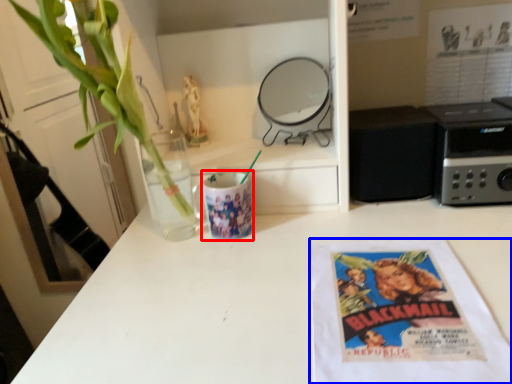
Question: Among these objects, which one is nearest to the camera, mug (highlighted by a red box) or paperback book (highlighted by a blue box)?

Choices:
 (A) mug
 (B) paperback book

Answer: (B)